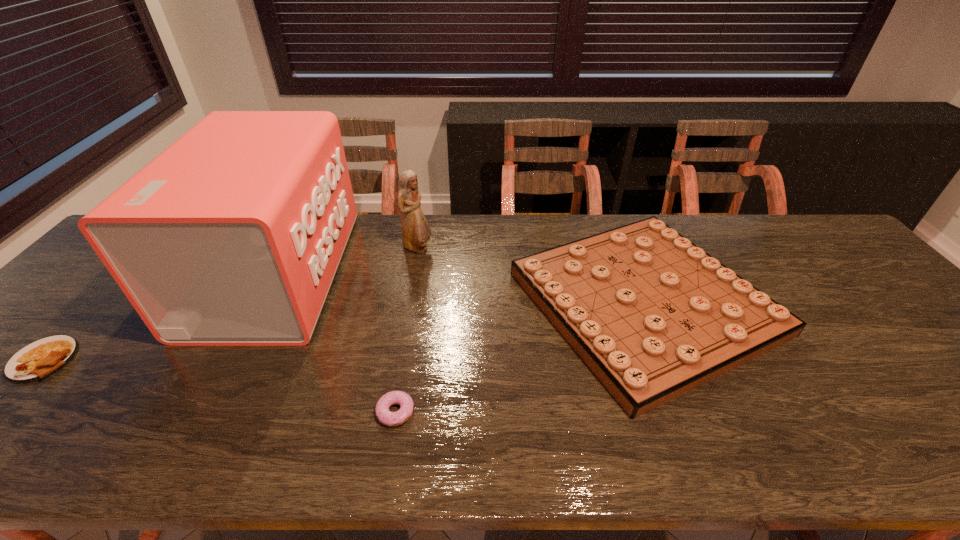
Identify the location of box located in the far edge section of the desktop. The height and width of the screenshot is (540, 960). (232, 236).

This screenshot has width=960, height=540. I want to click on figurine that is at the far edge, so click(416, 232).

Where is `gameboard located in the far edge section of the desktop`? The width and height of the screenshot is (960, 540). gameboard located in the far edge section of the desktop is located at coordinates [653, 316].

Identify the location of object that is at the near edge. The height and width of the screenshot is (540, 960). (384, 415).

In order to click on free region at the far edge of the desktop in this screenshot , I will do `click(768, 225)`.

At what (x,y) coordinates should I click in order to perform the action: click on blank space at the near edge. Please return your answer as a coordinate pair (x, y). Looking at the image, I should click on click(x=711, y=424).

The height and width of the screenshot is (540, 960). Find the location of `vacant space that's between the third shortest object and the doughnut`. vacant space that's between the third shortest object and the doughnut is located at coordinates (519, 357).

The height and width of the screenshot is (540, 960). What are the coordinates of `unoccupied position between the fourth object from right to left and the doughnut` in the screenshot? It's located at (336, 342).

The image size is (960, 540). I want to click on the closest object relative to the figurine, so click(232, 236).

Locate which object ranks in proximity to the omelet. Please provide its 2D coordinates. Your answer should be formatted as a tuple, i.e. [(x, y)], where the tuple contains the x and y coordinates of a point satisfying the conditions above.

[(232, 236)]